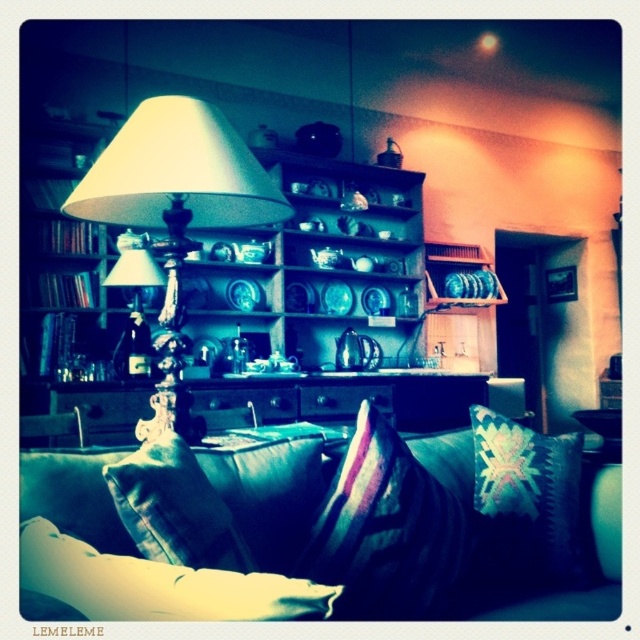
You are standing in the living room and want to place a small decorative item between the two points, point [179,241] and point [148,444]. Which point should you place it closer to so that it is in front of the first point but behind the second point?

To place the item in front of point [179,241] but behind point [148,444], you should position it closer to point [148,444] since point [179,241] is behind point [148,444].